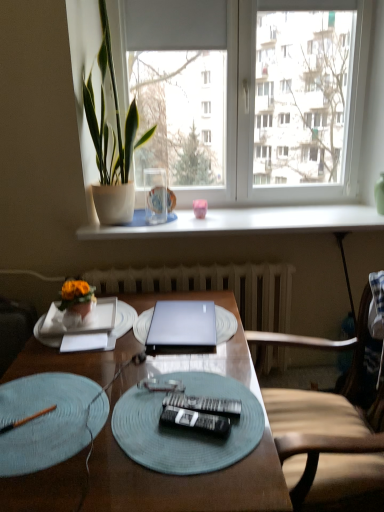
At what (x,y) coordinates should I click in order to perform the action: click on vacant area that is situated to the right of black plastic remote control at center, which is counted as the first remote control, starting from the back. Please return your answer as a coordinate pair (x, y). The image size is (384, 512). Looking at the image, I should click on (245, 407).